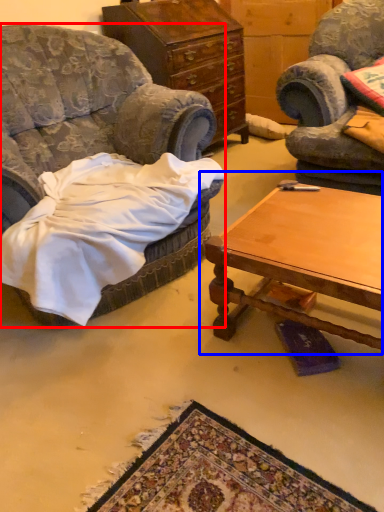
Question: Which of the following is the closest to the observer, chair (highlighted by a red box) or coffee table (highlighted by a blue box)?

Choices:
 (A) chair
 (B) coffee table

Answer: (A)